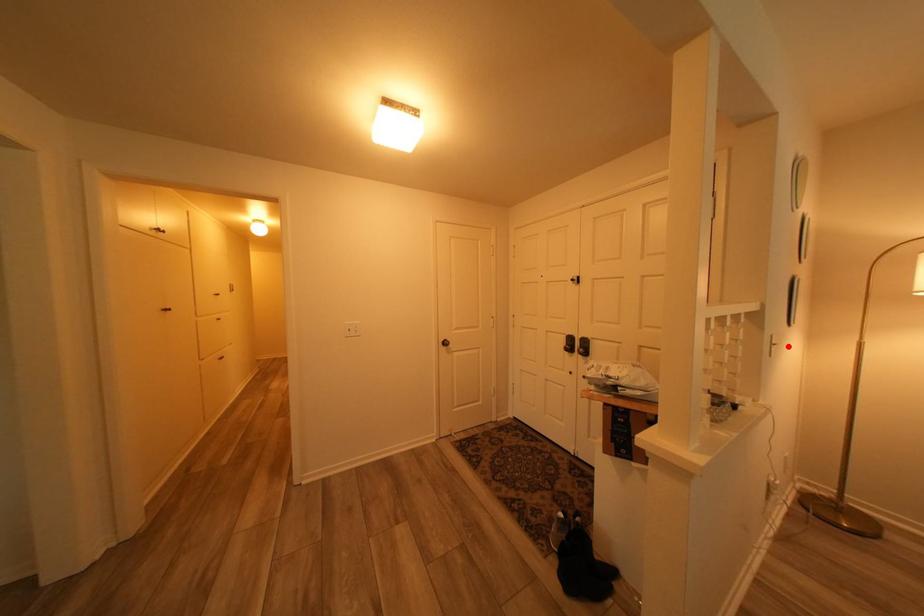
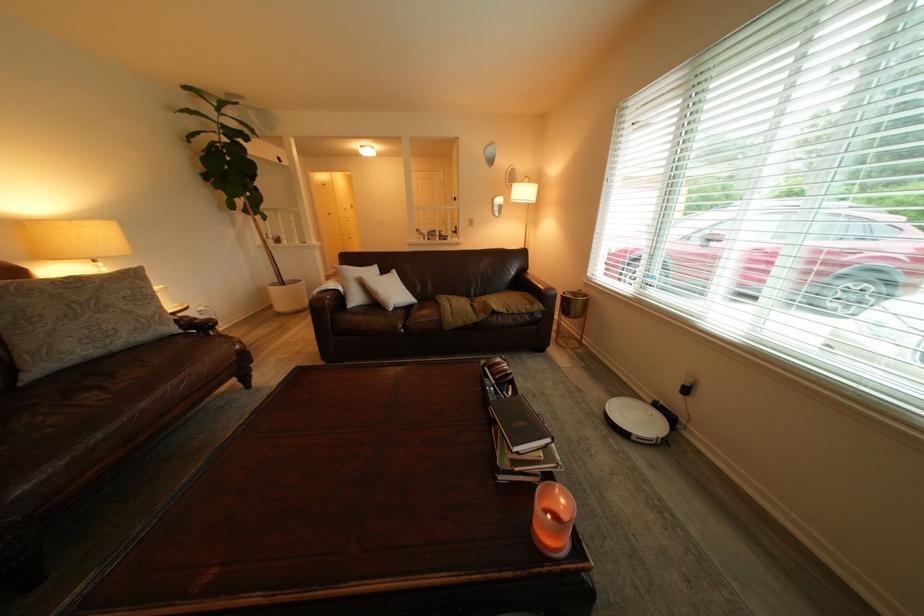
In the second image, find the point that corresponds to the highlighted location in the first image.

(484, 223)